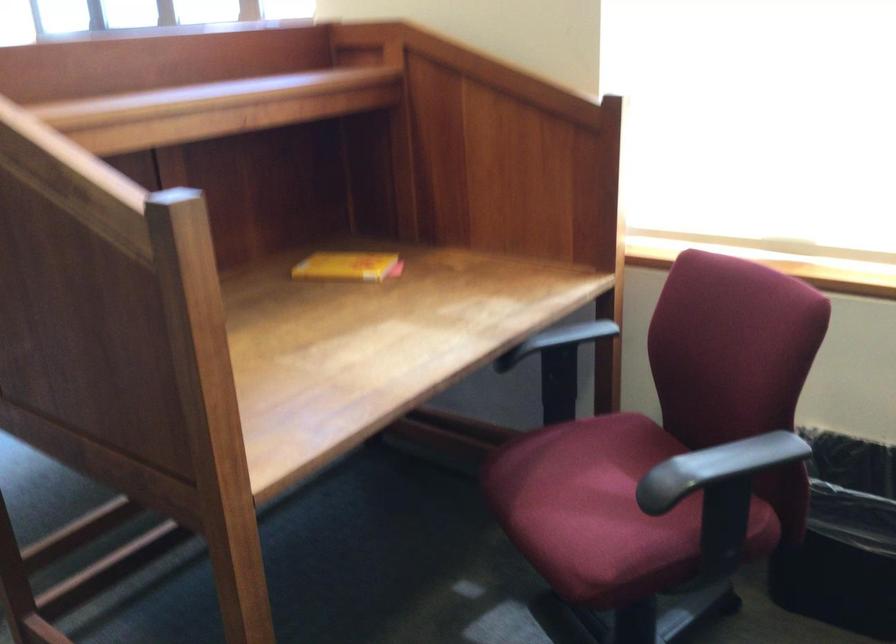
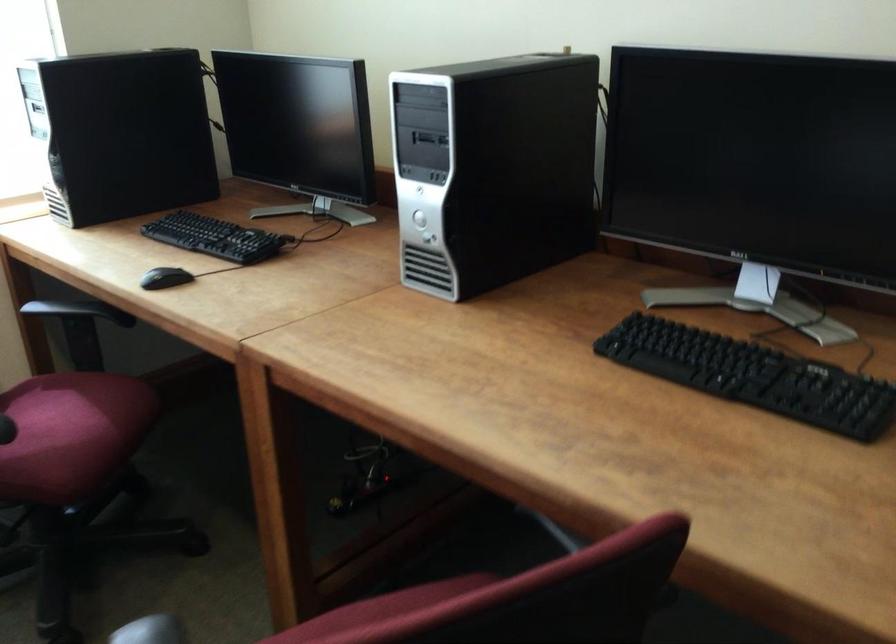
Question: How did the camera likely rotate?

Choices:
 (A) Left
 (B) Right
 (C) Up
 (D) Down

Answer: (B)